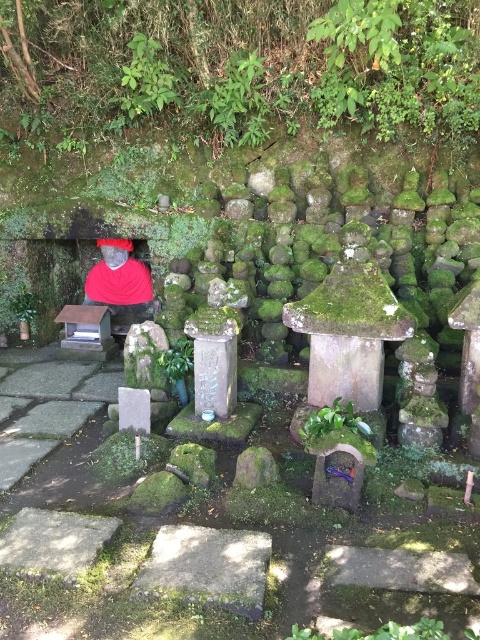
You are a visitor in the Japanese garden and want to place a small offering at the base of the green leafy plant at center. You notice the matte red shirt at left nearby. Considering their sizes, which object has a wider base to place the offering more securely?

The matte red shirt at left has a wider base than the green leafy plant at center, so placing the offering there would be more secure.

You are a visitor in this Japanese garden and want to take a photo of the green leafy plant at center. To avoid blocking the statue in the alcove, you need to position yourself to the right side of the matte red shirt at left. Is this possible based on their positions?

The matte red shirt at left is to the left of the green leafy plant at center. Positioning yourself to the right of the matte red shirt at left would place you directly in front of the green leafy plant at center, which is to the right of the shirt. This position should allow you to take the photo without blocking the statue in the alcove.